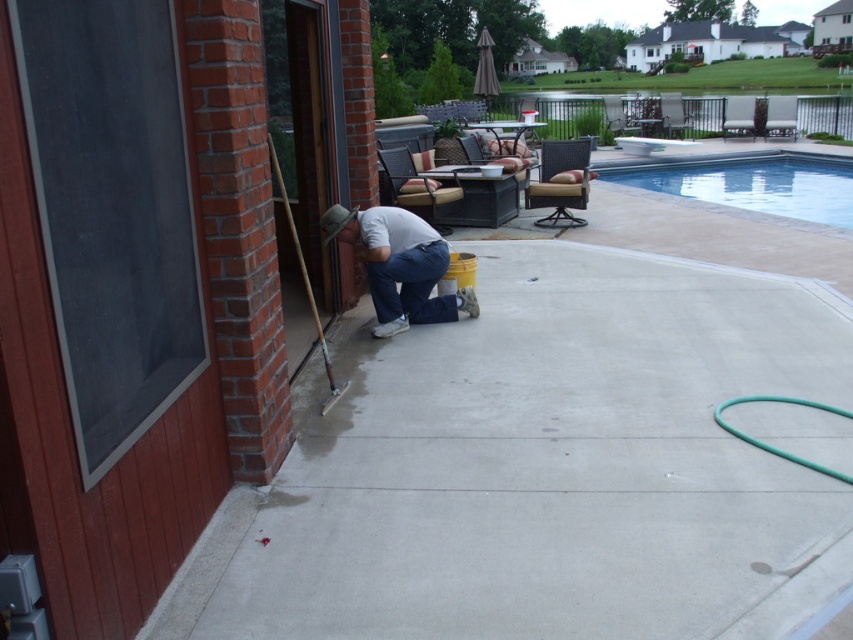
Question: Can you confirm if smooth concrete at center is smaller than denim jeans at lower center?

Choices:
 (A) no
 (B) yes

Answer: (A)

Question: Which object is closer to the camera taking this photo?

Choices:
 (A) smooth concrete at center
 (B) denim jeans at lower center
 (C) clear glass swimming pool at upper right

Answer: (A)

Question: Does clear glass swimming pool at upper right appear over denim jeans at lower center?

Choices:
 (A) yes
 (B) no

Answer: (A)

Question: Which of the following is the closest to the observer?

Choices:
 (A) smooth concrete at center
 (B) clear glass swimming pool at upper right

Answer: (A)

Question: Can you confirm if smooth concrete at center is positioned to the left of denim jeans at lower center?

Choices:
 (A) no
 (B) yes

Answer: (A)

Question: Which object is positioned farthest from the denim jeans at lower center?

Choices:
 (A) smooth concrete at center
 (B) clear glass swimming pool at upper right

Answer: (B)